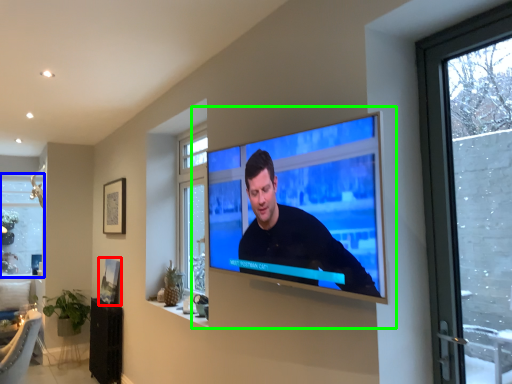
Question: Which is farther away from picture frame (highlighted by a red box)? window (highlighted by a blue box) or tv show (highlighted by a green box)?

Choices:
 (A) window
 (B) tv show

Answer: (A)